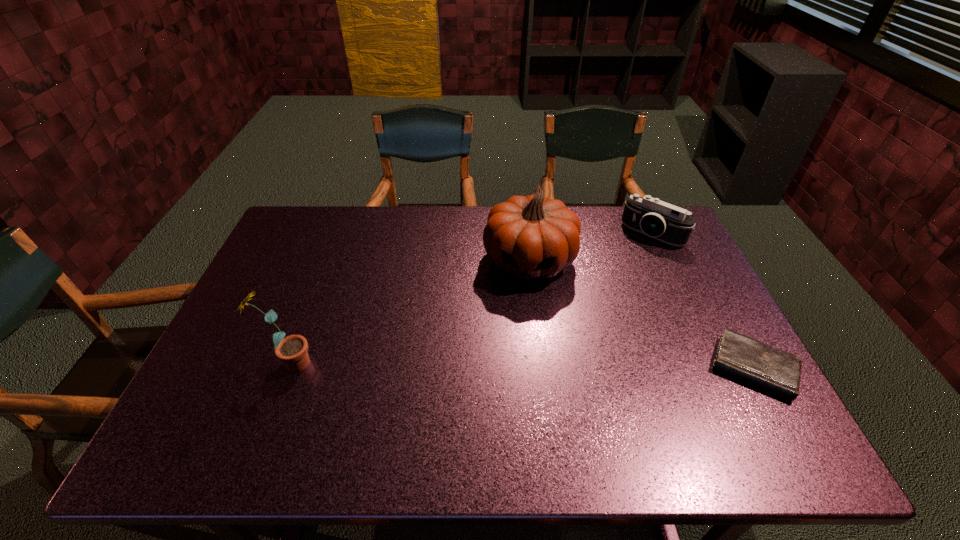
This screenshot has width=960, height=540. Identify the location of vacant space located on the front lens of the second shortest object. (611, 279).

Locate an element on the screen. This screenshot has height=540, width=960. vacant space located on the front lens of the second shortest object is located at coordinates (580, 313).

Locate an element on the screen. pumpkin positioned at the far edge is located at coordinates (532, 236).

Image resolution: width=960 pixels, height=540 pixels. I want to click on camera located in the far edge section of the desktop, so click(x=650, y=216).

Identify the location of object present at the near edge. This screenshot has width=960, height=540. (759, 364).

The width and height of the screenshot is (960, 540). I want to click on object that is at the left edge, so click(x=292, y=350).

The width and height of the screenshot is (960, 540). What are the coordinates of `diary that is at the right edge` in the screenshot? It's located at (759, 364).

At what (x,y) coordinates should I click in order to perform the action: click on camera present at the right edge. Please return your answer as a coordinate pair (x, y). The height and width of the screenshot is (540, 960). Looking at the image, I should click on (650, 216).

Where is `object that is at the far right corner`? object that is at the far right corner is located at coordinates (650, 216).

Locate an element on the screen. The width and height of the screenshot is (960, 540). object located in the near right corner section of the desktop is located at coordinates (759, 364).